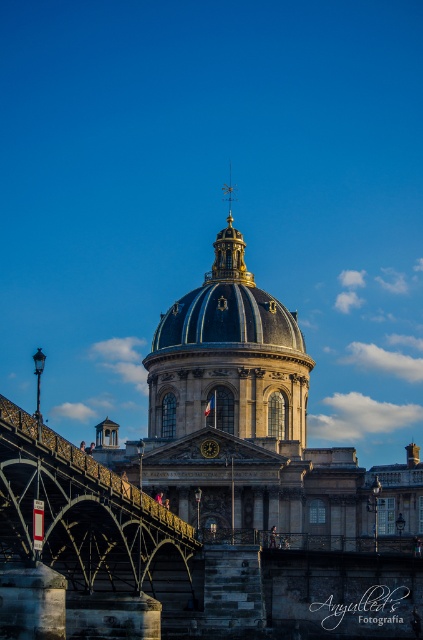
Question: Estimate the real-world distances between objects in this image. Which object is closer to the blue stone dome at center?

Choices:
 (A) stone bridge at center
 (B) matte gold dome at center

Answer: (B)

Question: Which point appears farthest from the camera in this image?

Choices:
 (A) (227, 346)
 (B) (7, 429)

Answer: (A)

Question: From the image, what is the correct spatial relationship of stone bridge at center in relation to matte gold dome at center?

Choices:
 (A) right
 (B) left

Answer: (B)

Question: From the image, what is the correct spatial relationship of stone bridge at center in relation to matte gold dome at center?

Choices:
 (A) right
 (B) left

Answer: (B)

Question: Is blue stone dome at center further to camera compared to matte gold dome at center?

Choices:
 (A) no
 (B) yes

Answer: (A)

Question: Which object is positioned farthest from the stone bridge at center?

Choices:
 (A) blue stone dome at center
 (B) matte gold dome at center

Answer: (B)